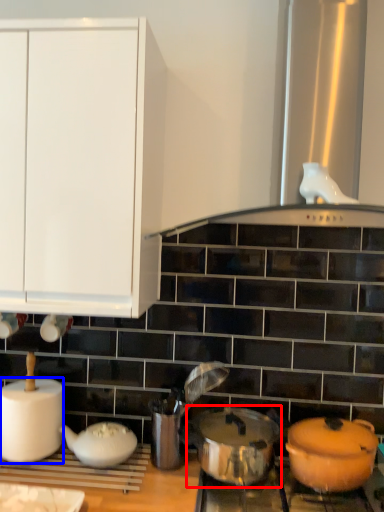
Question: Which object appears farthest to the camera in this image, crock pot (highlighted by a red box) or paper towel (highlighted by a blue box)?

Choices:
 (A) crock pot
 (B) paper towel

Answer: (B)